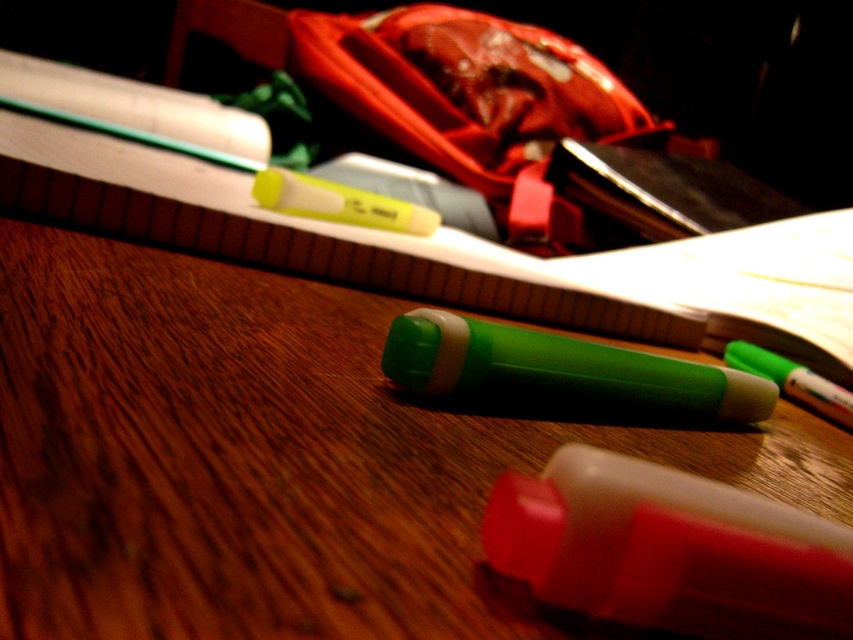
This screenshot has width=853, height=640. What do you see at coordinates (277, 458) in the screenshot? I see `green plastic highlighter at center` at bounding box center [277, 458].

Between point (566, 436) and point (412, 211), which one is positioned in front?

Point (566, 436) is more forward.

Identify the location of green plastic highlighter at center. (277, 458).

Is point (642, 467) positioned in front of point (804, 369)?

That is True.

Between translucent white crayon at center and green matte highlighter at center, which one has more height?

green matte highlighter at center

Does point (813, 529) come farther from viewer compared to point (850, 406)?

No, it is in front of (850, 406).

At what (x,y) coordinates should I click in order to perform the action: click on translucent white crayon at center. Please return your answer as a coordinate pair (x, y). This screenshot has height=640, width=853. Looking at the image, I should click on (669, 550).

In the scene shown: Which of these two, yellow matte highlighter at upper left or green matte highlighter at center, stands taller?

Standing taller between the two is yellow matte highlighter at upper left.

Is point (119, 125) behind point (770, 378)?

That is True.

The width and height of the screenshot is (853, 640). Identify the location of yellow matte highlighter at upper left. (329, 198).